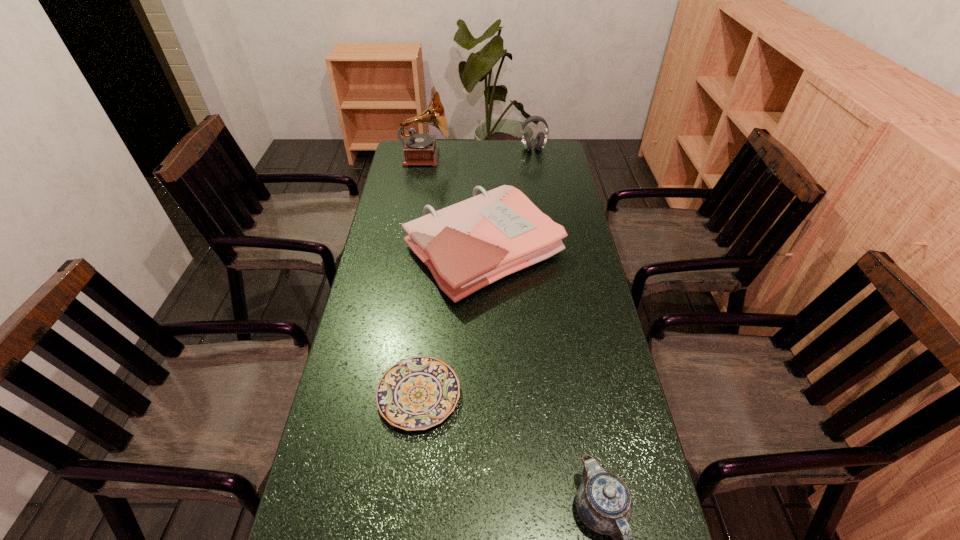
The image size is (960, 540). Identify the location of vacant space at the right edge of the desktop. (552, 179).

In the image, there is a desktop. Where is `vacant space at the far left corner`? The image size is (960, 540). vacant space at the far left corner is located at coordinates point(401,141).

Find the location of a particular element. vacant area at the far right corner is located at coordinates [547, 148].

Locate an element on the screen. The width and height of the screenshot is (960, 540). free space between the third nearest object and the tallest object is located at coordinates (454, 204).

The width and height of the screenshot is (960, 540). I want to click on vacant region between the headset and the tallest object, so click(479, 153).

Identify the location of empty space that is in between the phonograph_record and the plate. (422, 276).

The height and width of the screenshot is (540, 960). I want to click on vacant point located between the third farthest object and the tallest object, so click(454, 204).

Find the location of a particular element. The height and width of the screenshot is (540, 960). vacant area that lies between the phonograph_record and the fourth farthest object is located at coordinates (422, 276).

The height and width of the screenshot is (540, 960). I want to click on object that can be found as the fourth closest to the chinaware, so [541, 138].

The width and height of the screenshot is (960, 540). In order to click on object that ranks as the fourth closest to the plate in this screenshot , I will do `click(541, 138)`.